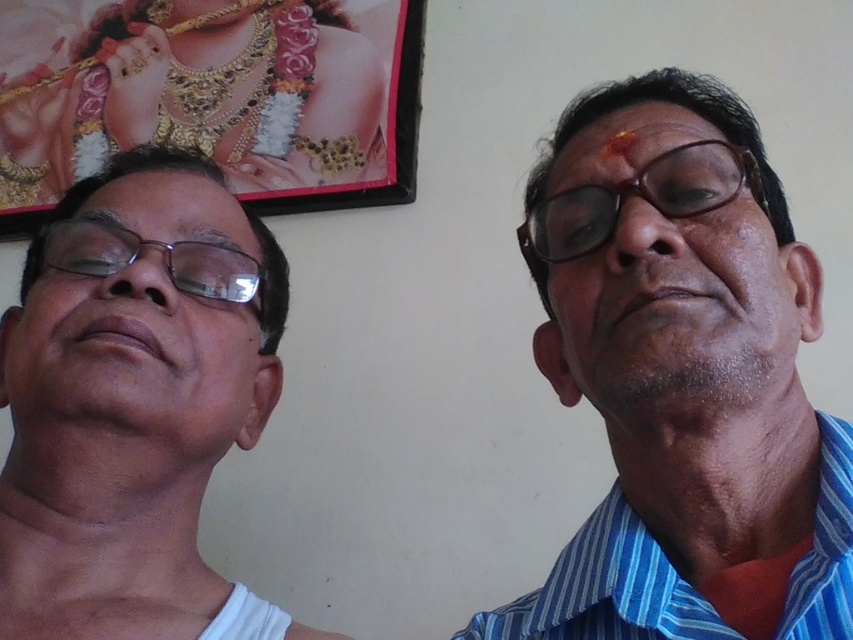
Who is lower down, matte black face at left or matte plastic glasses at left?

matte black face at left

Measure the distance between point (199,353) and camera.

The distance of point (199,353) from camera is 26.94 inches.

Identify the location of matte black face at left. This screenshot has height=640, width=853. (163, 276).

Which is more to the left, blue striped shirt at center or wooden frame at upper left?

wooden frame at upper left

Based on the photo, who is more forward, [614,262] or [44,1]?

Point [614,262] is more forward.

Who is more distant from viewer, (711,86) or (155,6)?

The point (155,6) is more distant.

Where is `blue striped shirt at center`? blue striped shirt at center is located at coordinates (683, 378).

Can you confirm if blue striped shirt at center is positioned to the left of matte blue shirt at right?

Correct, you'll find blue striped shirt at center to the left of matte blue shirt at right.

Is blue striped shirt at center thinner than matte blue shirt at right?

Incorrect, blue striped shirt at center's width is not less than matte blue shirt at right's.

Is point (810, 604) closer to camera compared to point (682, 218)?

Yes, it is in front of point (682, 218).

Identify the location of blue striped shirt at center. (683, 378).